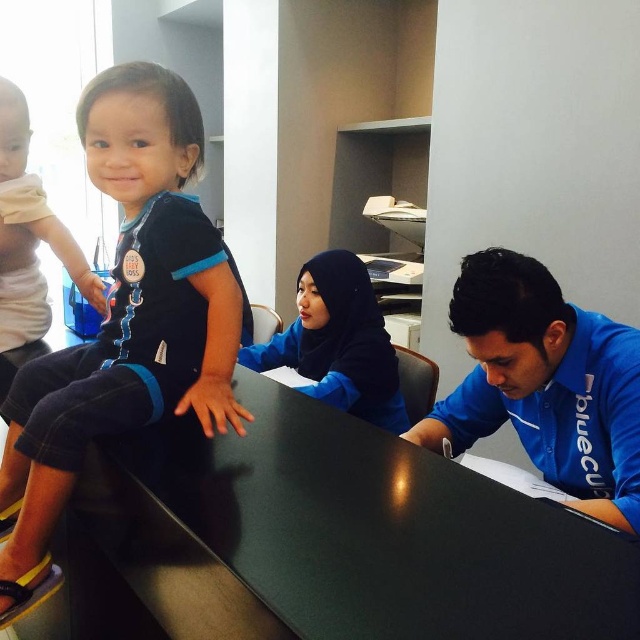
You are standing at the point labeled point (8, 134) in the office scene. You want to walk to the door located at point (92, 161). Is there a clear path between these two points?

Yes, there is a clear path between point (8, 134) and point (92, 161) because the first point is behind the second point, so you can walk straight towards it.

You are an office security guard who needs to verify the identities of the individuals wearing the matte black shirts. Which of the two, the matte black shirt at upper left or the matte black shirt at center, is closer to the entrance door located at the back of the office?

The matte black shirt at upper left is in front of the matte black shirt at center, so the matte black shirt at upper left is closer to the entrance door located at the back of the office.